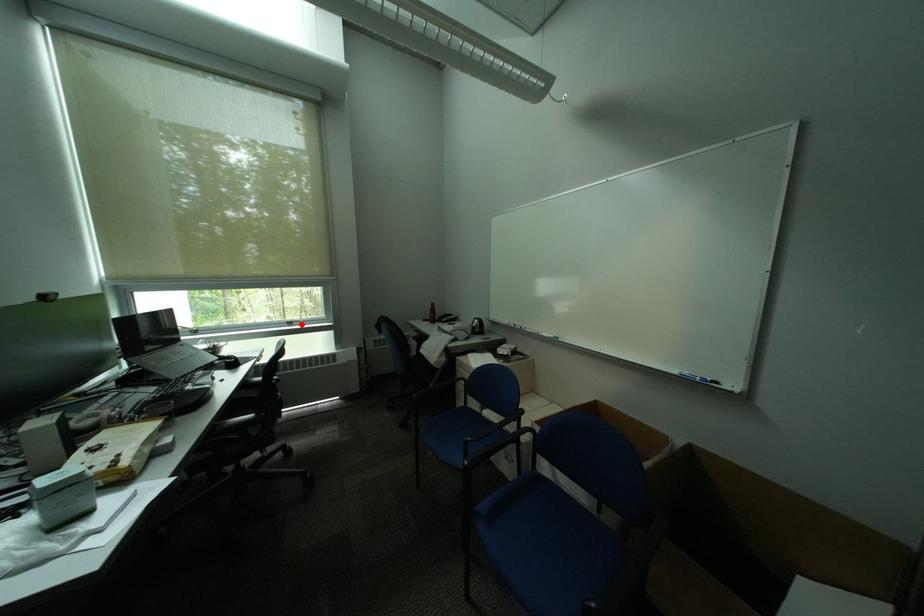
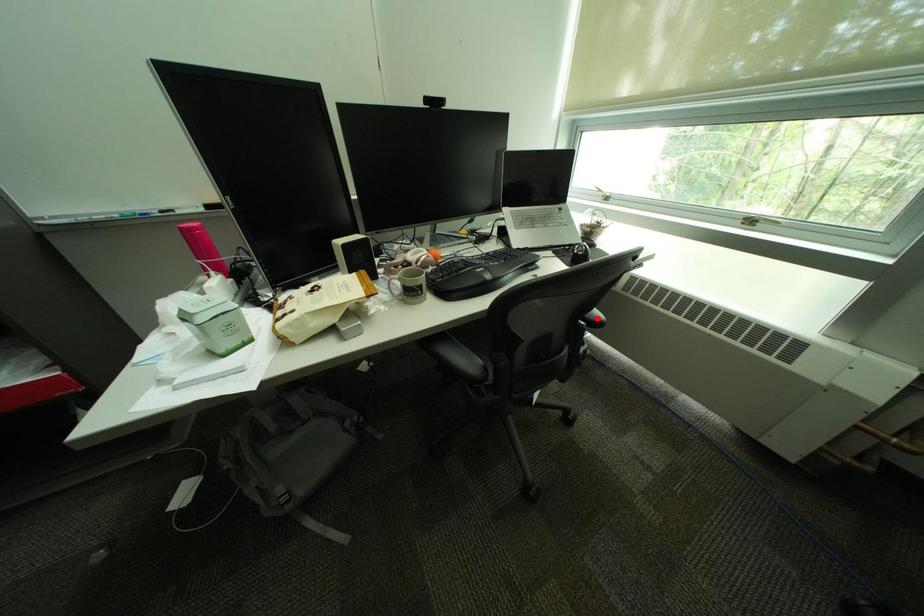
I am providing you with two images of the same scene from different viewpoints. A red point is marked on the first image and another point is marked on the second image. Is the marked point in image1 the same physical position as the marked point in image2?

No